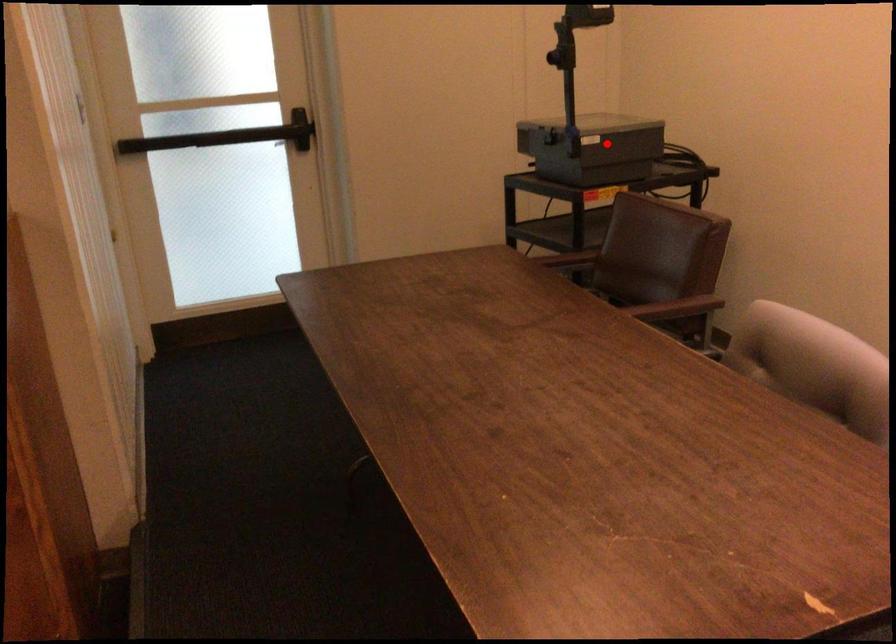
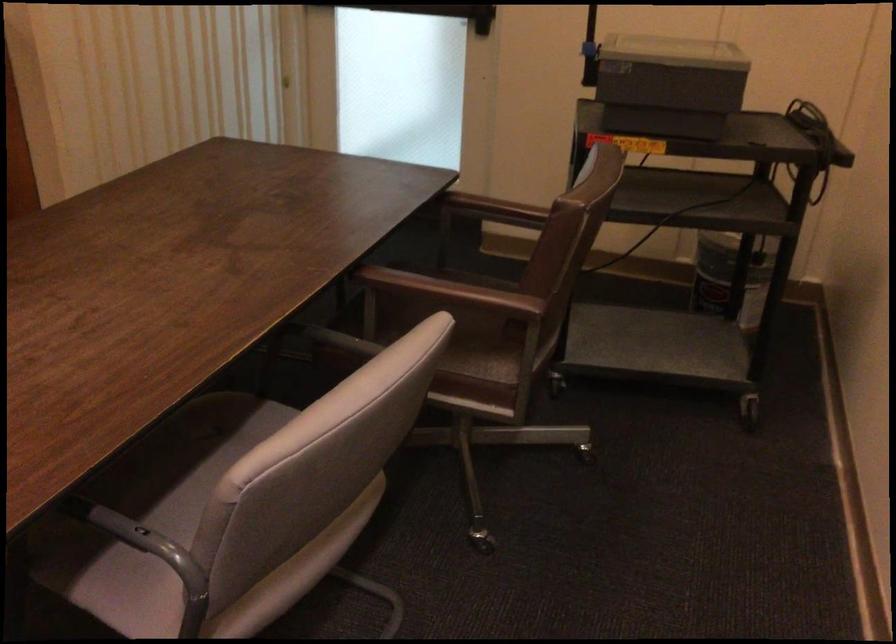
Where in the second image is the point corresponding to the highlighted location from the first image?

(668, 84)